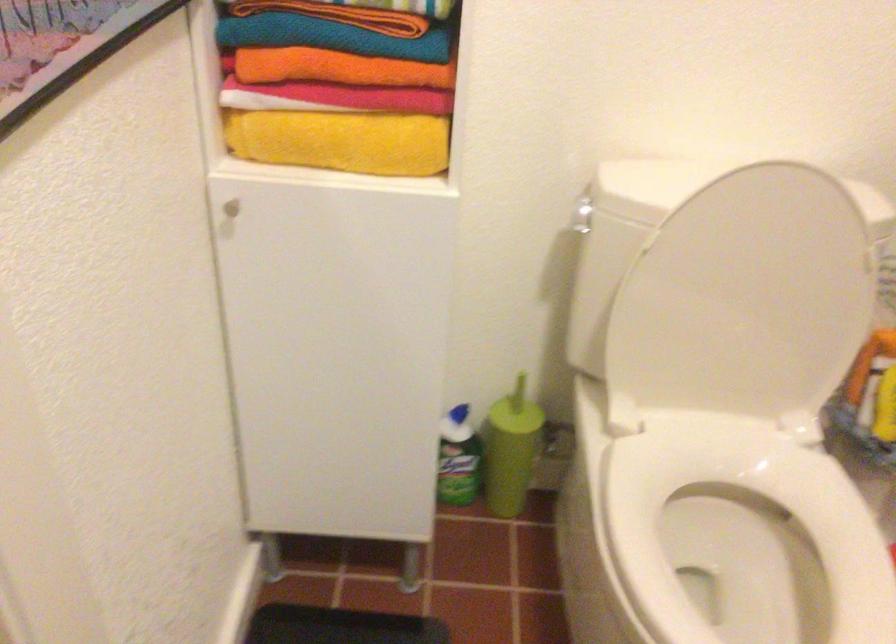
I want to click on white toilet seat, so click(x=742, y=525).